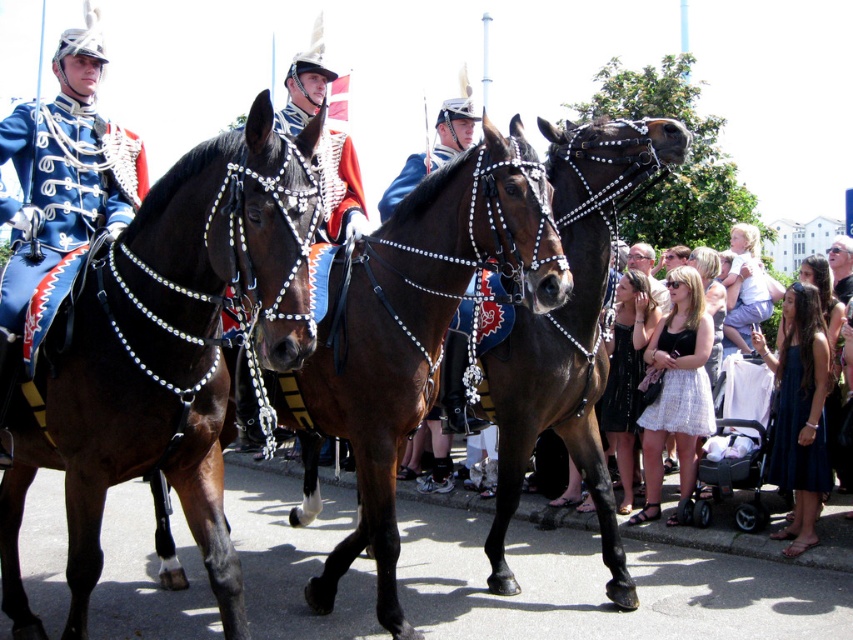
Which is above, shiny brown horse at center or blue satin uniform at left?

Positioned higher is blue satin uniform at left.

Does shiny brown horse at center appear over blue satin uniform at left?

No.

Who is more distant from viewer, (94, 349) or (20, 138)?

Positioned behind is point (20, 138).

This screenshot has height=640, width=853. Identify the location of shiny brown horse at center. (167, 353).

Is brown glossy horse at center positioned at the back of navy satin dress at lower right?

That is False.

Looking at this image, who is lower down, brown glossy horse at center or navy satin dress at lower right?

navy satin dress at lower right

Which is behind, point (500, 202) or point (814, 492)?

Point (814, 492)

Find the location of `brown glossy horse at center`. brown glossy horse at center is located at coordinates (415, 332).

What do you see at coordinates (167, 353) in the screenshot? Image resolution: width=853 pixels, height=640 pixels. I see `shiny brown horse at center` at bounding box center [167, 353].

From the picture: Does shiny brown horse at center lie in front of black satin dress at center?

That is True.

Measure the distance between shiny brown horse at center and camera.

They are 4.16 meters apart.

I want to click on shiny brown horse at center, so click(x=167, y=353).